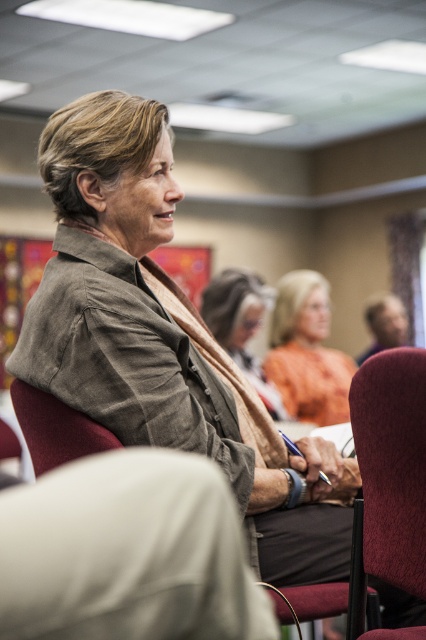
Question: Among these objects, which one is nearest to the camera?

Choices:
 (A) light brown textured sweater at center
 (B) maroon fabric chair at lower right
 (C) maroon fabric chair at lower left
 (D) orange matte shirt at center

Answer: (B)

Question: Is orange matte shirt at center bigger than light brown textured sweater at center?

Choices:
 (A) no
 (B) yes

Answer: (B)

Question: Is maroon fabric chair at lower right to the left of light brown textured sweater at center from the viewer's perspective?

Choices:
 (A) yes
 (B) no

Answer: (B)

Question: Is maroon fabric chair at lower right behind maroon fabric chair at lower left?

Choices:
 (A) no
 (B) yes

Answer: (A)

Question: Estimate the real-world distances between objects in this image. Which object is closer to the light brown textured sweater at center?

Choices:
 (A) orange matte shirt at center
 (B) maroon fabric chair at lower right

Answer: (A)

Question: Which object is positioned farthest from the light brown textured sweater at center?

Choices:
 (A) maroon fabric chair at lower left
 (B) maroon fabric chair at lower right

Answer: (B)